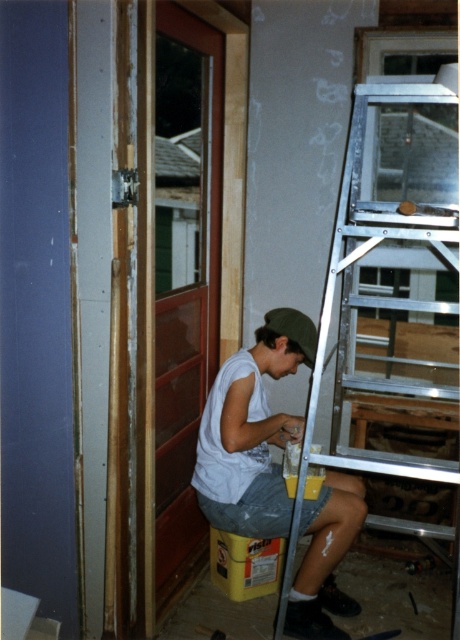
Who is more forward, (x=387, y=218) or (x=236, y=520)?

Point (x=387, y=218)

Is silver metallic ladder at right positioned in front of white matte shirt at center?

Yes, it is in front of white matte shirt at center.

Is point (358, 225) farther from viewer compared to point (276, 481)?

Yes.

Locate an element on the screen. The height and width of the screenshot is (640, 460). silver metallic ladder at right is located at coordinates (379, 296).